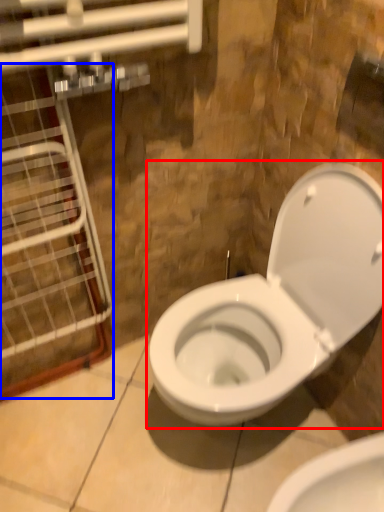
Question: Which point is closer to the camera, toilet (highlighted by a red box) or glass door (highlighted by a blue box)?

Choices:
 (A) toilet
 (B) glass door

Answer: (B)